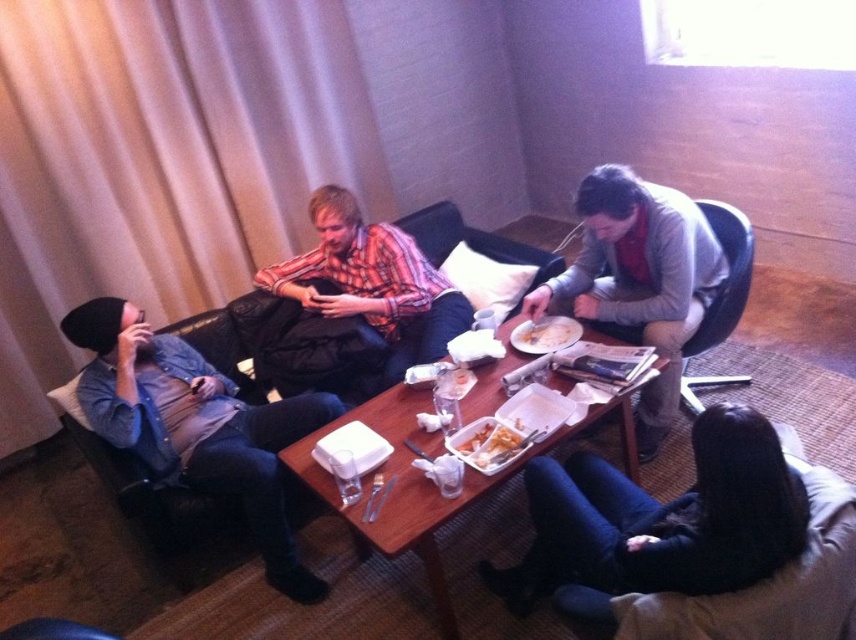
Does point (425, 396) come in front of point (554, 337)?

That is True.

Can you confirm if wooden table at center is wider than yellowish matte food at center?

Correct, the width of wooden table at center exceeds that of yellowish matte food at center.

What do you see at coordinates (428, 483) in the screenshot? I see `wooden table at center` at bounding box center [428, 483].

Where is `wooden table at center`? Image resolution: width=856 pixels, height=640 pixels. wooden table at center is located at coordinates (428, 483).

Describe the element at coordinates (284, 348) in the screenshot. I see `black leather couch at center` at that location.

Does black leather couch at center have a smaller size compared to wooden table at center?

Correct, black leather couch at center occupies less space than wooden table at center.

Which is behind, point (173, 529) or point (437, 577)?

Point (173, 529)

Identify the location of black leather couch at center. (284, 348).

Is point (509, 596) more distant than point (449, 310)?

No, it is not.

Between dark blue jeans at lower right and plaid shirt at center, which one is positioned lower?

Positioned lower is dark blue jeans at lower right.

Which is in front, point (728, 448) or point (405, 358)?

Point (728, 448) is more forward.

Where is `dark blue jeans at lower right`? The height and width of the screenshot is (640, 856). dark blue jeans at lower right is located at coordinates (663, 518).